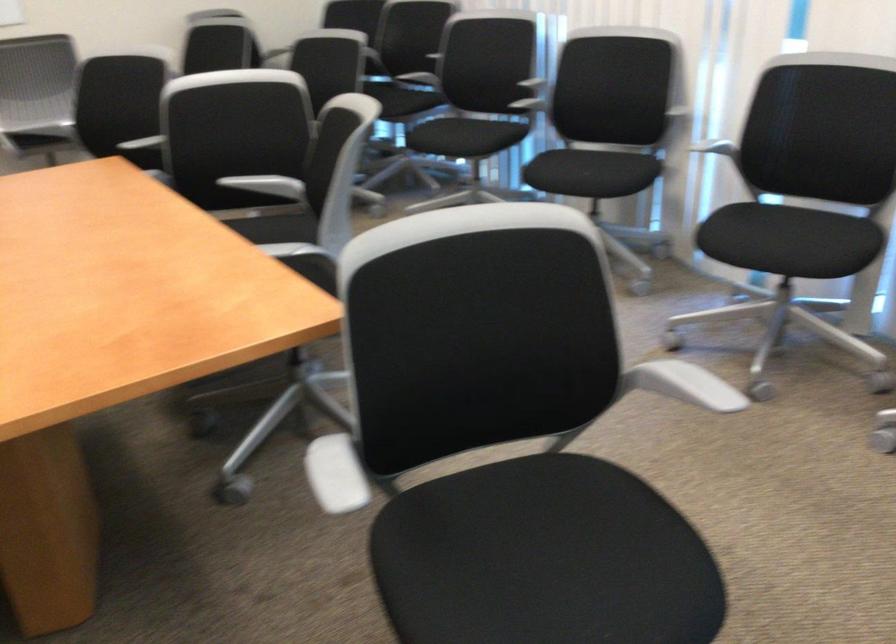
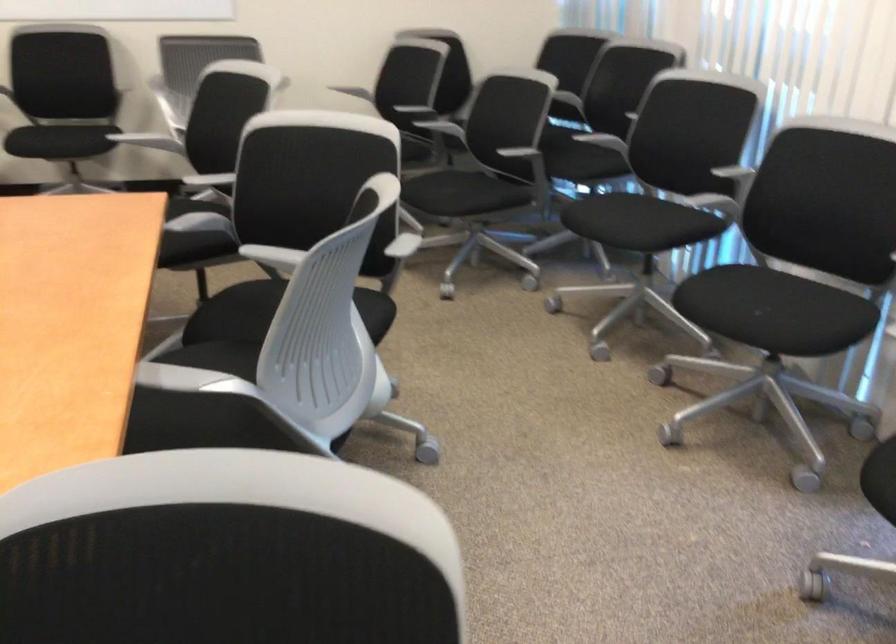
In the second image, find the point that corresponds to the point at 687,304 in the first image.

(858, 527)